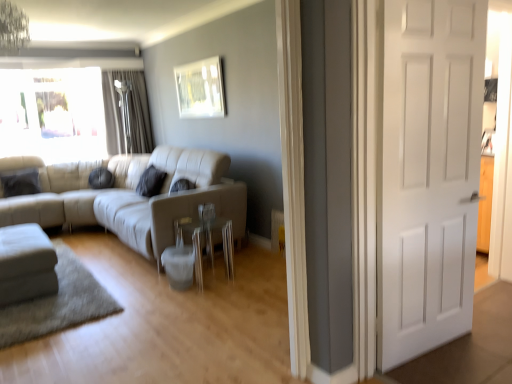
Question: From the image's perspective, would you say clear glass side table at center is shown under dark gray fabric curtain at upper left?

Choices:
 (A) yes
 (B) no

Answer: (A)

Question: Considering the relative positions of clear glass side table at center and dark gray fabric curtain at upper left in the image provided, is clear glass side table at center to the right of dark gray fabric curtain at upper left from the viewer's perspective?

Choices:
 (A) no
 (B) yes

Answer: (B)

Question: From a real-world perspective, is clear glass side table at center located higher than dark gray fabric curtain at upper left?

Choices:
 (A) no
 (B) yes

Answer: (A)

Question: Is clear glass side table at center facing towards dark gray fabric curtain at upper left?

Choices:
 (A) yes
 (B) no

Answer: (B)

Question: Considering the relative sizes of clear glass side table at center and dark gray fabric curtain at upper left in the image provided, is clear glass side table at center bigger than dark gray fabric curtain at upper left?

Choices:
 (A) no
 (B) yes

Answer: (A)

Question: Is beige leather couch at center, which is the 2th studio couch in left-to-right order, wider or thinner than metallic silver picture frame at upper center?

Choices:
 (A) wide
 (B) thin

Answer: (A)

Question: Choose the correct answer: Is beige leather couch at center, which is the first studio couch in right-to-left order, inside metallic silver picture frame at upper center or outside it?

Choices:
 (A) inside
 (B) outside

Answer: (B)

Question: Considering the relative positions of beige leather couch at center, which is the first studio couch in right-to-left order, and metallic silver picture frame at upper center in the image provided, is beige leather couch at center, which is the first studio couch in right-to-left order, to the left or to the right of metallic silver picture frame at upper center?

Choices:
 (A) right
 (B) left

Answer: (B)

Question: From their relative heights in the image, would you say beige leather couch at center, which is the 2th studio couch in left-to-right order, is taller or shorter than metallic silver picture frame at upper center?

Choices:
 (A) tall
 (B) short

Answer: (A)

Question: From the image's perspective, is dark gray fabric curtain at upper left positioned above or below white fabric ottoman at lower left, acting as the second studio couch starting from the right?

Choices:
 (A) above
 (B) below

Answer: (A)

Question: In terms of height, does dark gray fabric curtain at upper left look taller or shorter compared to white fabric ottoman at lower left, acting as the second studio couch starting from the right?

Choices:
 (A) short
 (B) tall

Answer: (B)

Question: In the image, is dark gray fabric curtain at upper left on the left side or the right side of white fabric ottoman at lower left, the first studio couch from the left?

Choices:
 (A) right
 (B) left

Answer: (A)

Question: Is dark gray fabric curtain at upper left inside or outside of white fabric ottoman at lower left, the first studio couch from the left?

Choices:
 (A) inside
 (B) outside

Answer: (B)

Question: In terms of width, does white fabric ottoman at lower left, acting as the second studio couch starting from the right, look wider or thinner when compared to dark gray fabric curtain at upper left?

Choices:
 (A) thin
 (B) wide

Answer: (B)

Question: Considering the positions of white fabric ottoman at lower left, the first studio couch from the left, and dark gray fabric curtain at upper left in the image, is white fabric ottoman at lower left, the first studio couch from the left, bigger or smaller than dark gray fabric curtain at upper left?

Choices:
 (A) big
 (B) small

Answer: (B)